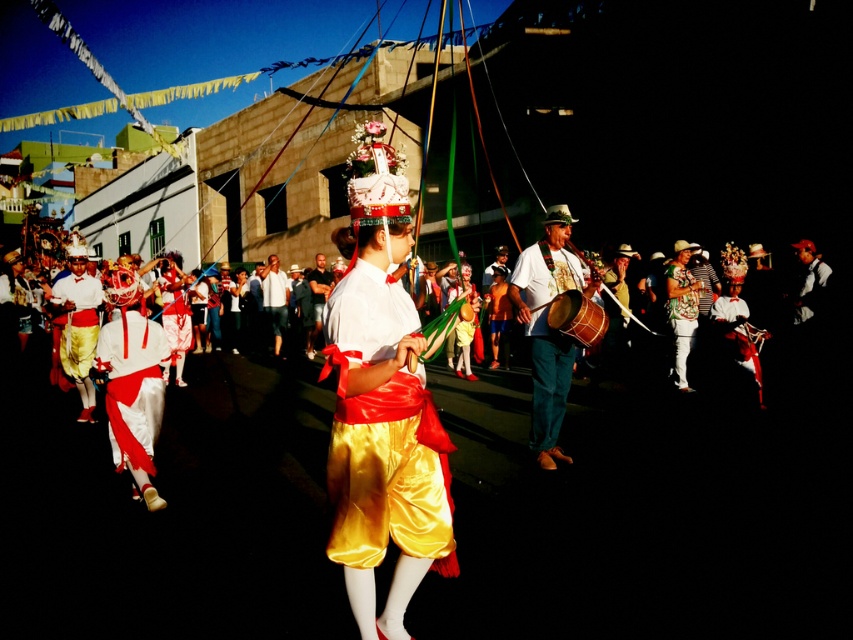
You are a photographer trying to capture the central performers at the festival. You notice the silky gold shorts at center and the wooden drum at center. Which object should you focus on first if you want to photograph the one closer to the ground?

The silky gold shorts at center is below wooden drum at center, so you should focus on the silky gold shorts at center first since it is closer to the ground.

You are a photographer trying to capture the central figure in the festival scene. You notice the matte brown drum at center and the white satin shorts at center. Which object should you focus on to ensure the central figure is in the frame?

→ The matte brown drum at center is above the white satin shorts at center, so focusing on the drum would ensure the central figure is in the frame since it is positioned higher up.